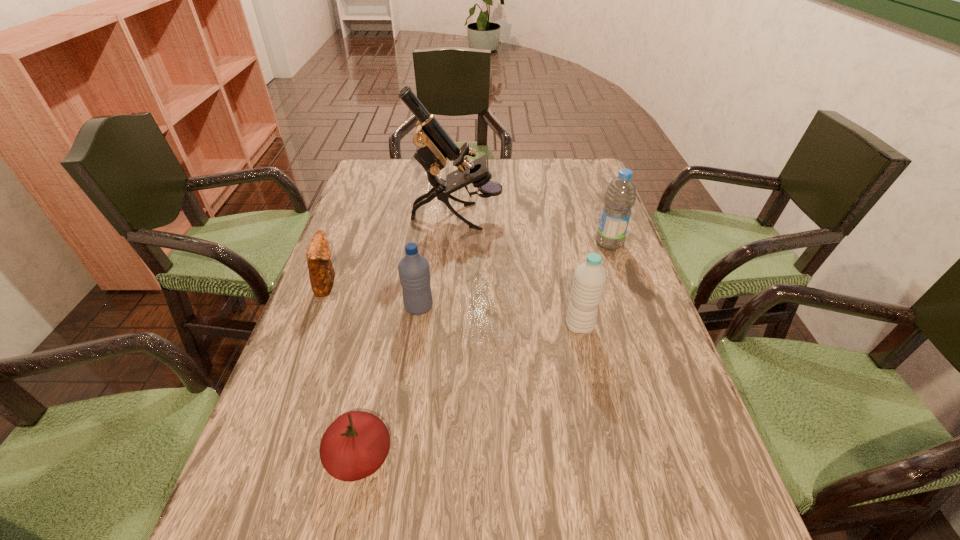
You are a GUI agent. You are given a task and a screenshot of the screen. Output one action in this format:
    pyautogui.click(x=<x>, y=<y>)
    Task: Click on the vacant space that satisfies the following two spatial constraints: 1. on the open side of the leftmost object; 2. on the left side of the leftmost water bottle
    The image size is (960, 540).
    Given the screenshot: What is the action you would take?
    pyautogui.click(x=319, y=307)

This screenshot has height=540, width=960. Identify the location of free space that satisfies the following two spatial constraints: 1. on the open side of the clutch bag; 2. on the left side of the leftmost water bottle. (319, 307).